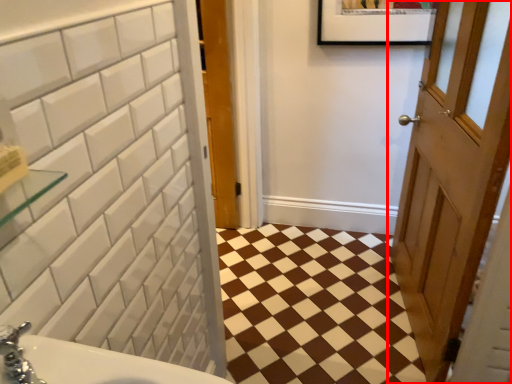
Question: In this image, where is door (annotated by the red box) located relative to ceramic tile?

Choices:
 (A) left
 (B) right

Answer: (B)